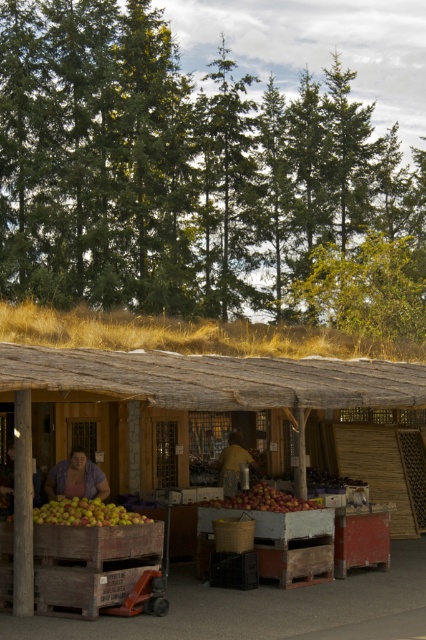
Question: Which of the following is the farthest from the observer?

Choices:
 (A) (344, 388)
 (B) (62, 480)
 (C) (232, 433)
 (D) (313, 157)

Answer: (D)

Question: Which of the following is the farthest from the observer?

Choices:
 (A) (22, 12)
 (B) (342, 358)
 (C) (259, 483)

Answer: (A)

Question: From the image, what is the correct spatial relationship of green matte pine at upper center in relation to wooden crates of apples at center?

Choices:
 (A) above
 (B) below

Answer: (A)

Question: Is matte purple shirt at center wider than brown fabric bag at center?

Choices:
 (A) no
 (B) yes

Answer: (B)

Question: Can you confirm if yellowish matte apples at lower left is positioned below shiny red apples at center?

Choices:
 (A) yes
 (B) no

Answer: (B)

Question: Among these objects, which one is farthest from the camera?

Choices:
 (A) brown fabric bag at center
 (B) wooden crates of apples at center

Answer: (A)